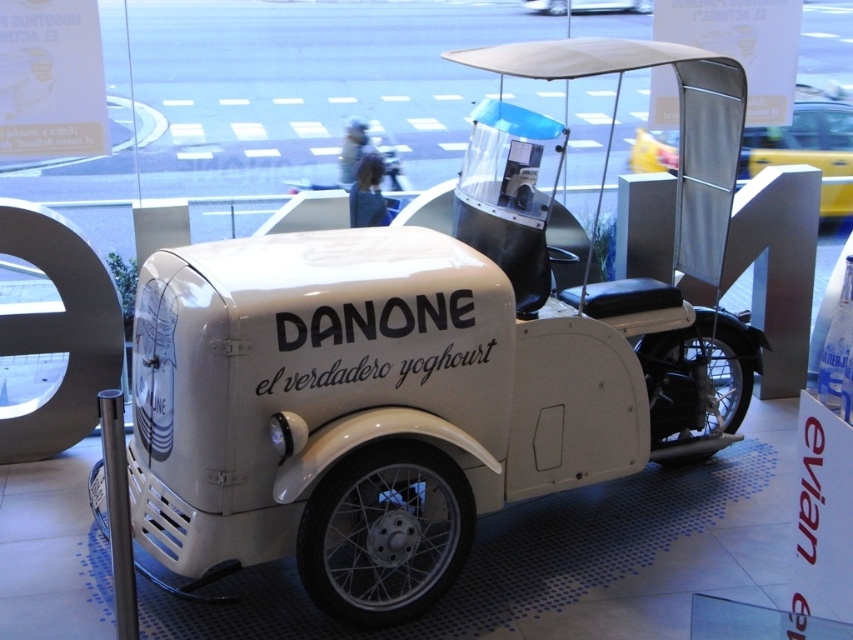
The image size is (853, 640). Describe the element at coordinates (403, 394) in the screenshot. I see `white matte cart at center` at that location.

Who is more distant from viewer, (287, 444) or (550, 13)?

The point (550, 13) is more distant.

Image resolution: width=853 pixels, height=640 pixels. Find the location of `white matte cart at center`. white matte cart at center is located at coordinates (403, 394).

Is white matte motorcycle at center behind white matte motorcycle at upper center?

No, it is in front of white matte motorcycle at upper center.

Is white matte motorcycle at center smaller than white matte motorcycle at upper center?

Incorrect, white matte motorcycle at center is not smaller in size than white matte motorcycle at upper center.

This screenshot has width=853, height=640. Identify the location of white matte motorcycle at center. (808, 147).

Does white matte cart at center have a larger size compared to white matte motorcycle at center?

Correct, white matte cart at center is larger in size than white matte motorcycle at center.

Which is in front, point (701, 406) or point (766, 163)?

Point (701, 406) is more forward.

Locate an element on the screen. The height and width of the screenshot is (640, 853). white matte cart at center is located at coordinates [403, 394].